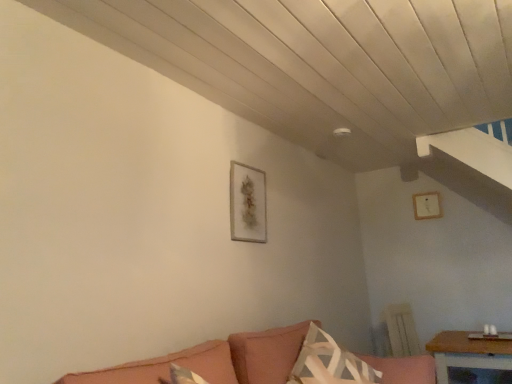
Image resolution: width=512 pixels, height=384 pixels. What do you see at coordinates (215, 360) in the screenshot?
I see `velvet pink couch at lower center` at bounding box center [215, 360].

The width and height of the screenshot is (512, 384). Identify the location of wooden table at lower right. (467, 353).

I want to click on wooden picture frame at upper right, the 1th picture frame from the right, so click(426, 205).

Identify the location of velvet pink couch at lower center. pos(215,360).

Is white textured pillow at lower center far away from wooden picture frame at upper right, the 1th picture frame from the right?

white textured pillow at lower center is positioned a significant distance from wooden picture frame at upper right, the 1th picture frame from the right.

Based on the photo, which is more distant, [320,378] or [436,203]?

The point [436,203] is more distant.

Is white textured pillow at lower center in front of or behind wooden picture frame at upper right, the first picture frame in the back-to-front sequence, in the image?

Clearly, white textured pillow at lower center is in front of wooden picture frame at upper right, the first picture frame in the back-to-front sequence.

In the scene shown: Measure the distance between white textured pillow at lower center and wooden picture frame at upper right, acting as the second picture frame starting from the left.

2.25 meters.

Is matte gold picture frame at center, which ranks as the 2th picture frame in back-to-front order, closer to the viewer compared to velvet pink couch at lower center?

That is False.

From the picture: Is matte gold picture frame at center, marked as the first picture frame in a front-to-back arrangement, far away from velvet pink couch at lower center?

No.

Is point (266, 237) positioned before point (216, 344)?

No, it is not.

Based on their sizes in the image, would you say matte gold picture frame at center, which is counted as the first picture frame, starting from the left, is bigger or smaller than velvet pink couch at lower center?

matte gold picture frame at center, which is counted as the first picture frame, starting from the left, is smaller than velvet pink couch at lower center.

Who is shorter, matte gold picture frame at center, which is counted as the first picture frame, starting from the left, or white textured pillow at lower center?

white textured pillow at lower center.

You are a GUI agent. You are given a task and a screenshot of the screen. Output one action in this format:
    pyautogui.click(x=<x>, y=<y>)
    Task: Click on the pillow lying below the matte gold picture frame at center, marked as the first picture frame in a front-to-back arrangement (from the image's perspective)
    The image size is (512, 384).
    Given the screenshot: What is the action you would take?
    pyautogui.click(x=329, y=363)

Is matte gold picture frame at center, which ranks as the 2th picture frame in back-to-front order, inside the boundaries of white textured pillow at lower center, or outside?

matte gold picture frame at center, which ranks as the 2th picture frame in back-to-front order, is not enclosed by white textured pillow at lower center.

Which is less distant, (263, 205) or (319, 361)?

Point (263, 205) is positioned farther from the camera compared to point (319, 361).

Considering the relative sizes of wooden table at lower right and wooden picture frame at upper right, the 1th picture frame from the right, in the image provided, is wooden table at lower right taller than wooden picture frame at upper right, the 1th picture frame from the right,?

Indeed, wooden table at lower right has a greater height compared to wooden picture frame at upper right, the 1th picture frame from the right.

At what (x,y) coordinates should I click in order to perform the action: click on table that is under the wooden picture frame at upper right, acting as the second picture frame starting from the left (from a real-world perspective). Please return your answer as a coordinate pair (x, y). This screenshot has width=512, height=384. Looking at the image, I should click on (467, 353).

Between wooden table at lower right and wooden picture frame at upper right, which is the second picture frame from front to back, which one appears on the left side from the viewer's perspective?

wooden table at lower right is more to the left.

How different are the orientations of wooden table at lower right and wooden picture frame at upper right, acting as the second picture frame starting from the left, in degrees?

wooden table at lower right and wooden picture frame at upper right, acting as the second picture frame starting from the left, are facing 92.8 degrees away from each other.

Based on the photo, does velvet pink couch at lower center have a greater width compared to matte gold picture frame at center, marked as the first picture frame in a front-to-back arrangement?

Correct, the width of velvet pink couch at lower center exceeds that of matte gold picture frame at center, marked as the first picture frame in a front-to-back arrangement.

Is velvet pink couch at lower center looking in the opposite direction of matte gold picture frame at center, which is counted as the first picture frame, starting from the left?

That's not correct — velvet pink couch at lower center is not looking away from matte gold picture frame at center, which is counted as the first picture frame, starting from the left.

Is velvet pink couch at lower center next to matte gold picture frame at center, the second picture frame when ordered from right to left, and touching it?

No, velvet pink couch at lower center is not next to matte gold picture frame at center, the second picture frame when ordered from right to left.

How many degrees apart are the facing directions of white textured pillow at lower center and matte gold picture frame at center, marked as the first picture frame in a front-to-back arrangement?

22.9 degrees.

Is white textured pillow at lower center positioned beyond the bounds of matte gold picture frame at center, which ranks as the 2th picture frame in back-to-front order?

Yes, white textured pillow at lower center is located beyond the bounds of matte gold picture frame at center, which ranks as the 2th picture frame in back-to-front order.

From the image's perspective, is white textured pillow at lower center positioned above or below matte gold picture frame at center, marked as the first picture frame in a front-to-back arrangement?

white textured pillow at lower center is situated lower than matte gold picture frame at center, marked as the first picture frame in a front-to-back arrangement, in the image.

Which is behind, point (297, 370) or point (250, 232)?

Positioned behind is point (250, 232).

Which object is closer to the camera taking this photo, velvet pink couch at lower center or wooden picture frame at upper right, acting as the second picture frame starting from the left?

velvet pink couch at lower center is in front.

Is velvet pink couch at lower center in contact with wooden picture frame at upper right, the 1th picture frame from the right?

No, velvet pink couch at lower center is not making contact with wooden picture frame at upper right, the 1th picture frame from the right.

Between velvet pink couch at lower center and wooden picture frame at upper right, which is the second picture frame from front to back, which one has larger width?

velvet pink couch at lower center.

From the picture: Is velvet pink couch at lower center positioned with its back to wooden picture frame at upper right, acting as the second picture frame starting from the left?

No, velvet pink couch at lower center is not facing the opposite direction of wooden picture frame at upper right, acting as the second picture frame starting from the left.

I want to click on pillow below the wooden picture frame at upper right, which is the second picture frame from front to back (from the image's perspective), so click(x=329, y=363).

I want to click on studio couch that appears in front of the matte gold picture frame at center, which ranks as the 2th picture frame in back-to-front order, so click(x=215, y=360).

Based on their spatial positions, is velvet pink couch at lower center or wooden table at lower right closer to wooden picture frame at upper right, which is the second picture frame from front to back?

wooden table at lower right.

When comparing their distances from wooden picture frame at upper right, which is the second picture frame from front to back, does wooden table at lower right or velvet pink couch at lower center seem further?

Among the two, velvet pink couch at lower center is located further to wooden picture frame at upper right, which is the second picture frame from front to back.

Estimate the real-world distances between objects in this image. Which object is closer to white textured pillow at lower center, wooden table at lower right or velvet pink couch at lower center?

Among the two, velvet pink couch at lower center is located nearer to white textured pillow at lower center.

From the image, which object appears to be farther from wooden table at lower right, white textured pillow at lower center or wooden picture frame at upper right, the 1th picture frame from the right?

wooden picture frame at upper right, the 1th picture frame from the right, is further to wooden table at lower right.

When comparing their distances from white textured pillow at lower center, does velvet pink couch at lower center or wooden table at lower right seem closer?

velvet pink couch at lower center is positioned closer to the anchor white textured pillow at lower center.

When comparing their distances from velvet pink couch at lower center, does white textured pillow at lower center or wooden table at lower right seem further?

wooden table at lower right.

When comparing their distances from wooden picture frame at upper right, which is the second picture frame from front to back, does wooden table at lower right or matte gold picture frame at center, which ranks as the 2th picture frame in back-to-front order, seem closer?

wooden table at lower right.

From the image, which object appears to be farther from wooden table at lower right, matte gold picture frame at center, which is counted as the first picture frame, starting from the left, or velvet pink couch at lower center?

matte gold picture frame at center, which is counted as the first picture frame, starting from the left, is further to wooden table at lower right.

Identify the location of table between velvet pink couch at lower center and wooden picture frame at upper right, the first picture frame in the back-to-front sequence, along the z-axis. This screenshot has width=512, height=384. (467, 353).

Find the location of a particular element. table located between white textured pillow at lower center and wooden picture frame at upper right, which is the second picture frame from front to back, in the depth direction is located at coordinates (467, 353).

The width and height of the screenshot is (512, 384). In order to click on picture frame located between velvet pink couch at lower center and wooden picture frame at upper right, acting as the second picture frame starting from the left, in the depth direction in this screenshot , I will do `click(248, 203)`.

Find the location of a particular element. Image resolution: width=512 pixels, height=384 pixels. pillow between velvet pink couch at lower center and wooden picture frame at upper right, the 1th picture frame from the right, along the z-axis is located at coordinates 329,363.